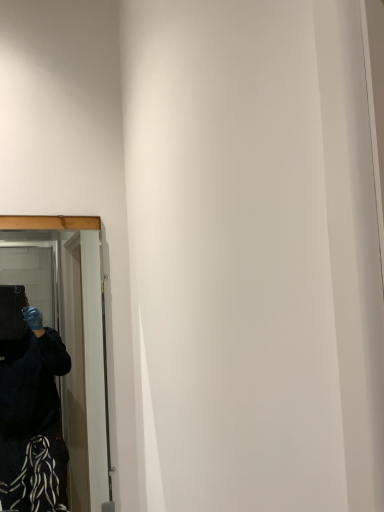
You are a GUI agent. You are given a task and a screenshot of the screen. Output one action in this format:
    pyautogui.click(x=<x>, y=<y>)
    Task: Click on the black matte screen door at left
    The width and height of the screenshot is (384, 512).
    Given the screenshot: What is the action you would take?
    pyautogui.click(x=76, y=343)

What do you see at coordinates (76, 343) in the screenshot?
I see `black matte screen door at left` at bounding box center [76, 343].

The image size is (384, 512). In order to click on black matte screen door at left in this screenshot , I will do coord(76,343).